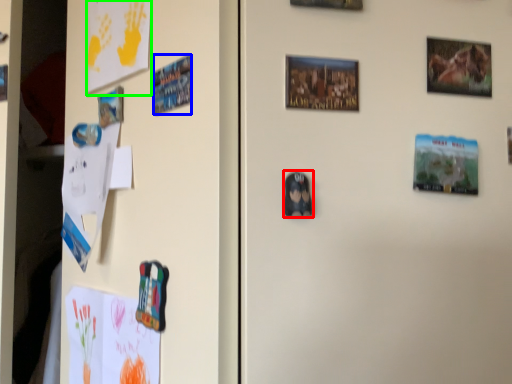
Question: Which is nearer to the print (highlighted by a red box)? print (highlighted by a blue box) or postcard (highlighted by a green box).

Choices:
 (A) print
 (B) postcard

Answer: (A)